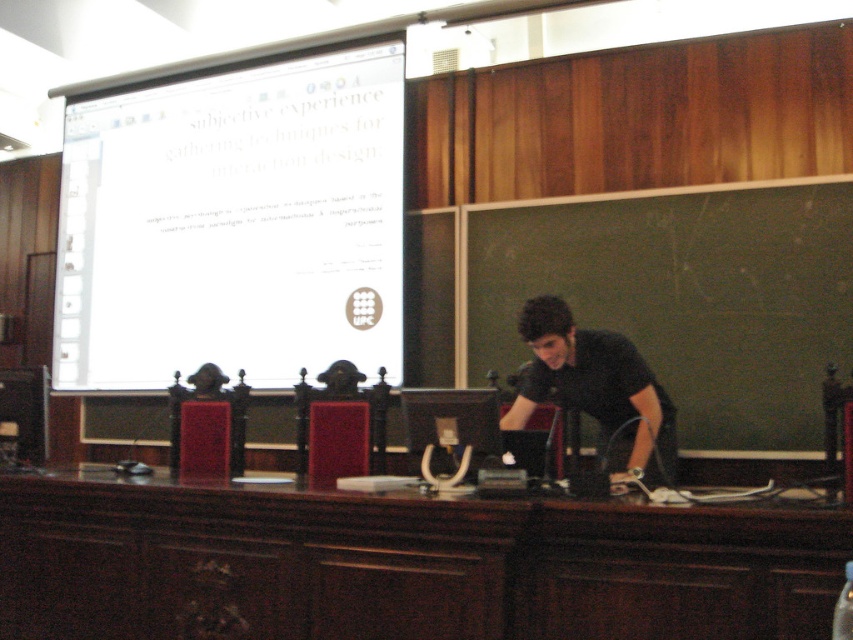
Between dark wood table at center and white glossy projection screen at upper center, which one appears on the right side from the viewer's perspective?

Positioned to the right is dark wood table at center.

Does point (352, 552) come farther from viewer compared to point (160, 112)?

No, (352, 552) is closer to viewer.

Is point (184, 554) farther from viewer compared to point (252, 209)?

No.

The width and height of the screenshot is (853, 640). In order to click on dark wood table at center in this screenshot , I will do `click(403, 564)`.

Is green chalkboard at center closer to the viewer compared to black matte shirt at center?

No, green chalkboard at center is further to the viewer.

Where is `green chalkboard at center`? Image resolution: width=853 pixels, height=640 pixels. green chalkboard at center is located at coordinates (685, 296).

Where is `green chalkboard at center`? This screenshot has width=853, height=640. green chalkboard at center is located at coordinates (685, 296).

Who is more forward, (252, 163) or (799, 262)?

Positioned in front is point (799, 262).

Is white glossy projection screen at upper center bigger than green chalkboard at center?

Yes, white glossy projection screen at upper center is bigger than green chalkboard at center.

The height and width of the screenshot is (640, 853). What do you see at coordinates (233, 225) in the screenshot?
I see `white glossy projection screen at upper center` at bounding box center [233, 225].

The height and width of the screenshot is (640, 853). I want to click on white glossy projection screen at upper center, so click(233, 225).